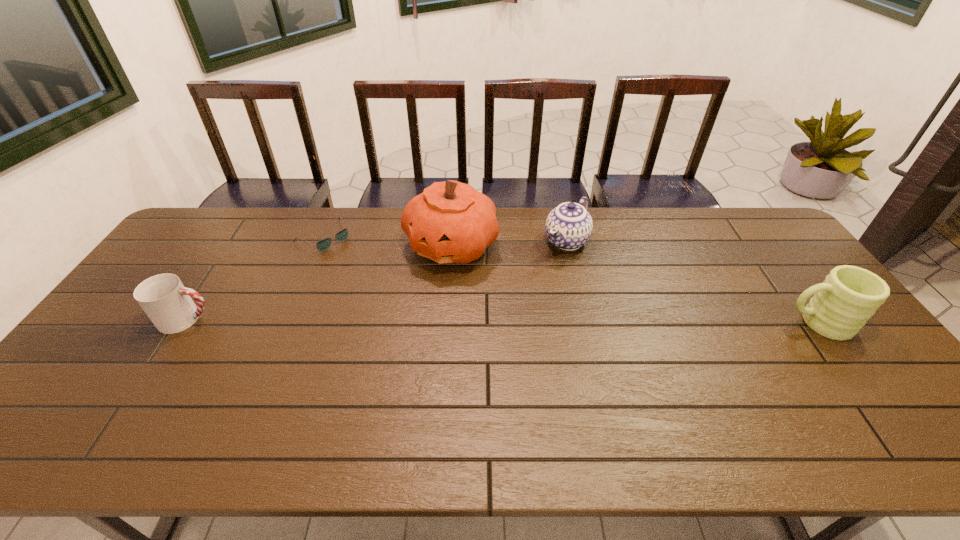
Where is `free space located on the lenses of the shortest object`? free space located on the lenses of the shortest object is located at coordinates (385, 286).

Identify the location of chinaware situated at the far edge. (569, 226).

The width and height of the screenshot is (960, 540). I want to click on pumpkin that is at the far edge, so click(x=451, y=222).

This screenshot has width=960, height=540. What are the coordinates of `sunglasses located in the far edge section of the desktop` in the screenshot? It's located at (323, 245).

The width and height of the screenshot is (960, 540). In order to click on object that is at the left edge in this screenshot , I will do (x=165, y=300).

At what (x,y) coordinates should I click in order to perform the action: click on object that is at the right edge. Please return your answer as a coordinate pair (x, y). Looking at the image, I should click on (848, 297).

Where is `free spot at the far edge of the desktop`? The image size is (960, 540). free spot at the far edge of the desktop is located at coordinates (354, 214).

In the image, there is a desktop. Identify the location of free region at the near edge. [x=307, y=407].

Image resolution: width=960 pixels, height=540 pixels. In order to click on vacant point at the right edge in this screenshot , I will do `click(835, 357)`.

Identify the location of empty space that is in between the third object from right to left and the rightmost object. The height and width of the screenshot is (540, 960). click(x=635, y=284).